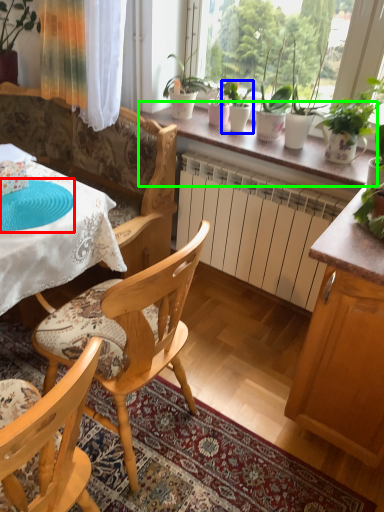
Question: Estimate the real-world distances between objects in this image. Which object is closer to paper plate (highlighted by a red box), houseplant (highlighted by a blue box) or window sill (highlighted by a green box)?

Choices:
 (A) houseplant
 (B) window sill

Answer: (B)